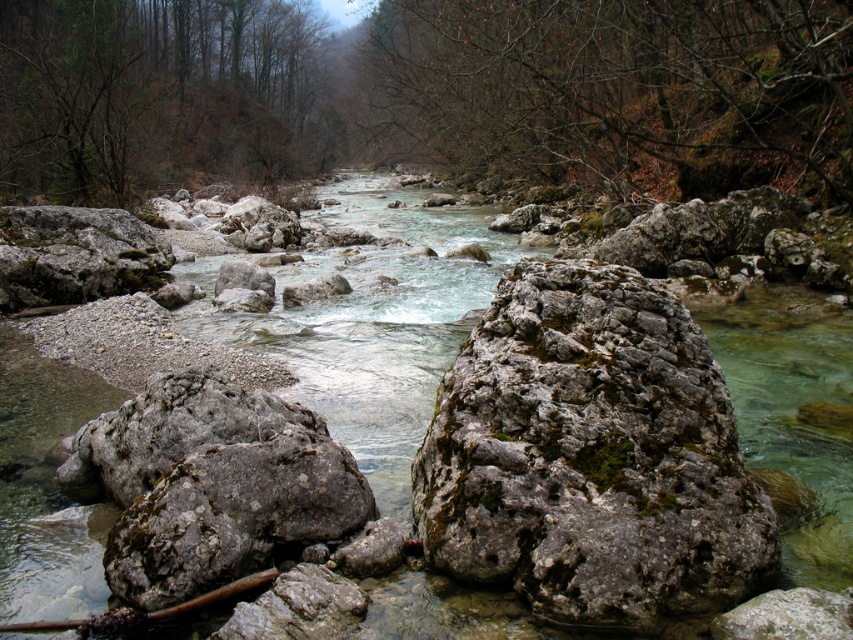
Question: Is green mossy rocks at center smaller than gray rough rock at center?

Choices:
 (A) yes
 (B) no

Answer: (B)

Question: Which object is positioned closest to the clear water stream at center?

Choices:
 (A) green mossy rocks at center
 (B) gray rough rock at center

Answer: (B)

Question: Can you confirm if clear water stream at center is positioned to the right of gray rough rock at center?

Choices:
 (A) yes
 (B) no

Answer: (B)

Question: Which object is positioned farthest from the green mossy rocks at center?

Choices:
 (A) gray rough rock at center
 (B) clear water stream at center

Answer: (B)

Question: Which of these objects is positioned closest to the clear water stream at center?

Choices:
 (A) green mossy rocks at center
 (B) gray rough rock at center

Answer: (B)

Question: Where is green mossy rocks at center located in relation to gray rough rock at center in the image?

Choices:
 (A) above
 (B) below

Answer: (A)